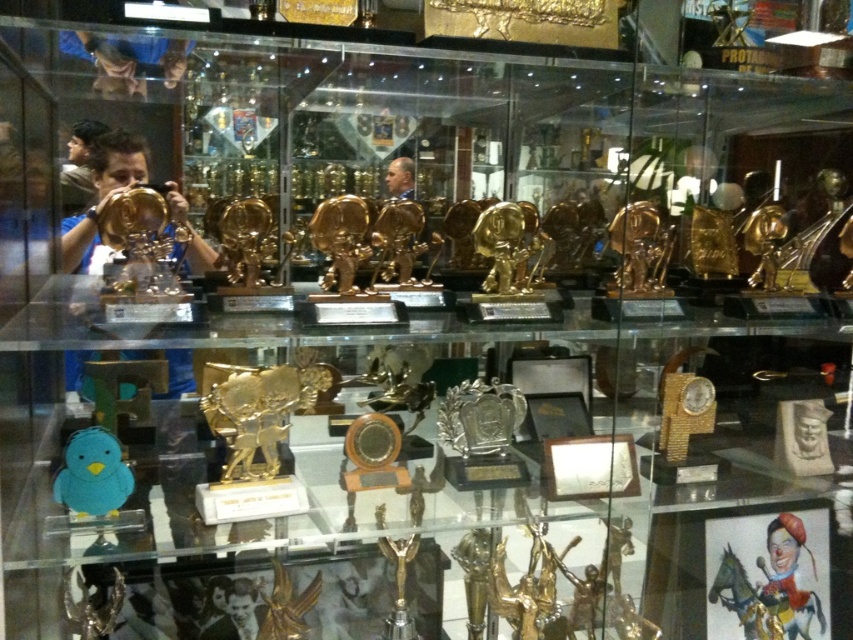
You are an interior designer arranging items in a display case. You need to place a new item between the matte gold trophy at left and the smooth gold statue at center. Where should you position it to maintain symmetry?

To maintain symmetry, place the new item between the matte gold trophy at left and the smooth gold statue at center, ensuring it is equidistant from both. Since the matte gold trophy at left is to the left of the smooth gold statue at center, centering the new item between them will create a balanced arrangement.

You are standing in front of the display case and want to pick up the matte gold trophy at left and the smooth gold statue at center. Which one would you need to reach further to grab?

You would need to reach further to grab the smooth gold statue at center because it is farther away from you compared to the matte gold trophy at left, which is closer.

You are an interior designer planning to place a new decorative item in the display case. The display case has a coordinate system where the bottom left corner is the origin point. The new item must be placed at least 0.1 units away from any existing object. Given the coordinates of the matte gold trophy at left, can you suggest a safe coordinate for the new item?

The matte gold trophy at left is located at point (x=102, y=193). To ensure a safe distance of at least 0.1 units away, the new item could be placed at coordinates such as (x=170, y=256) or (x=170, y=128), as these points are more than 0.1 units away from the existing trophy.